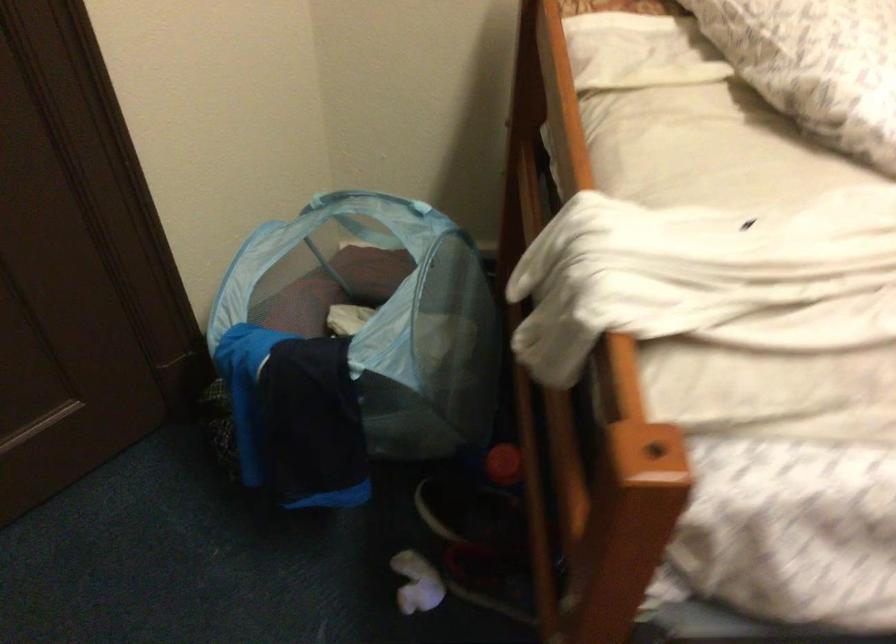
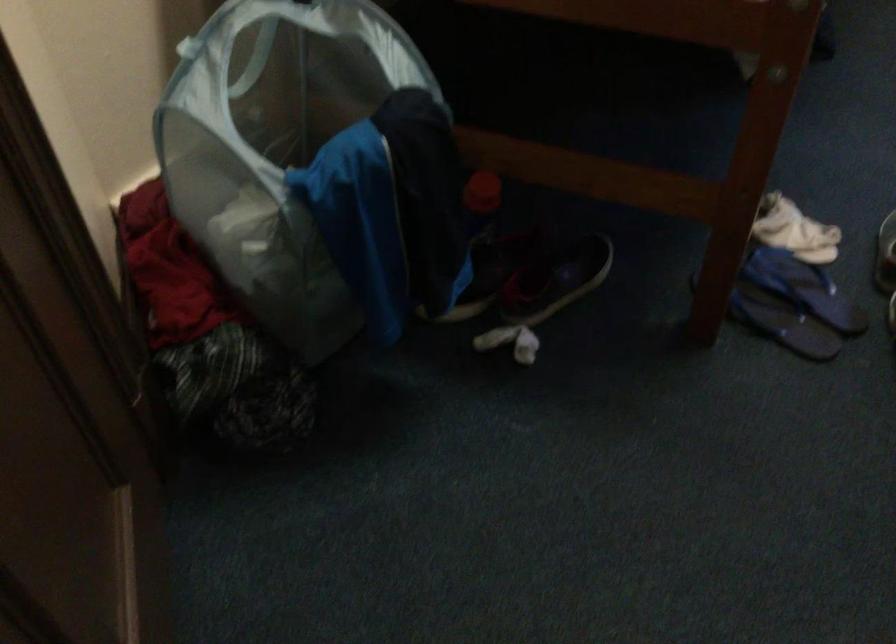
Question: I am providing you with two images of the same scene from different viewpoints. Which of the following objects are not visible in image2?

Choices:
 (A) black shoe
 (B) crumpled white sock
 (C) white lamp shade
 (D) bottle with red cap

Answer: (A)